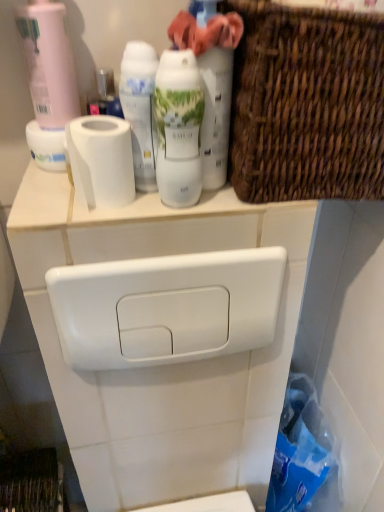
Question: Would you say pink matte bottle at upper left, positioned as the first cleaning product in left-to-right order, is inside or outside white matte toilet paper at upper left?

Choices:
 (A) inside
 (B) outside

Answer: (B)

Question: Is pink matte bottle at upper left, positioned as the first cleaning product in left-to-right order, in front of or behind white matte toilet paper at upper left in the image?

Choices:
 (A) behind
 (B) front

Answer: (A)

Question: Which object is positioned closest to the white glossy toilet tank at upper center?

Choices:
 (A) white glossy shaving cream at center, which appears as the 1th shaving cream when viewed from the left
 (B) matte white spray can at upper center, which is counted as the 1th cleaning product, starting from the right
 (C) pink matte bottle at upper left, the 2th cleaning product positioned from the right
 (D) matte white shaving cream at center, arranged as the second shaving cream when viewed from the left
 (E) white matte toilet paper at upper left

Answer: (D)

Question: Which is farther from the white glossy toilet tank at upper center?

Choices:
 (A) matte white shaving cream at center, acting as the first shaving cream starting from the right
 (B) white glossy shaving cream at center, arranged as the 2th shaving cream when viewed from the right
 (C) matte white spray can at upper center, placed as the second cleaning product when sorted from left to right
 (D) woven brown basket at upper right
 (E) white matte toilet paper at upper left

Answer: (B)